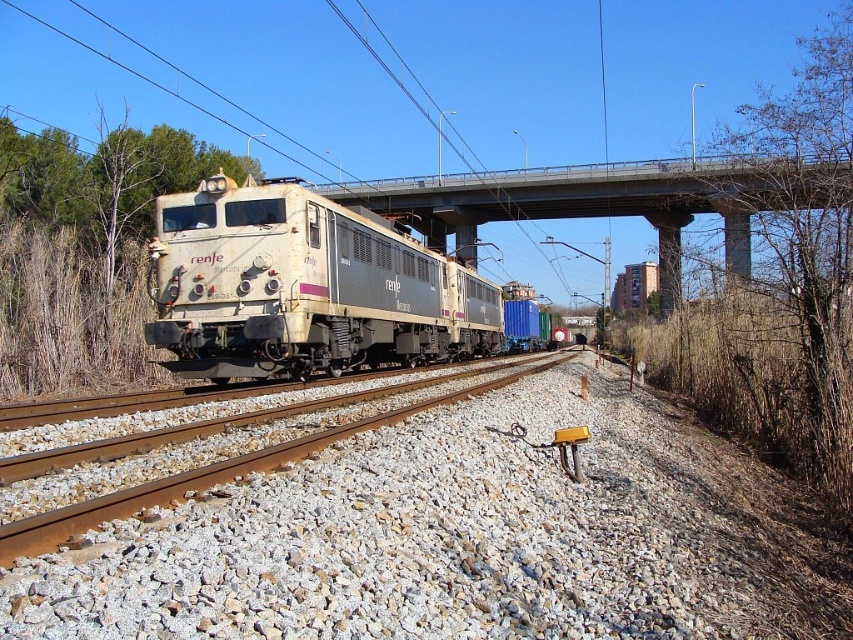
You are a railway inspector assessing the scene. The white matte train at center is approaching the concrete bridge at center. Based on their sizes, do you think the train can pass under the bridge safely?

The white matte train at center has a smaller size compared to the concrete bridge at center, so it can safely pass under the bridge without any issues.

You are a railway inspector checking the clearance of the white matte train at center and the concrete bridge at center. Which object has a shorter length?

→ The white matte train at center is shorter than the concrete bridge at center, so the white matte train at center has a shorter length.